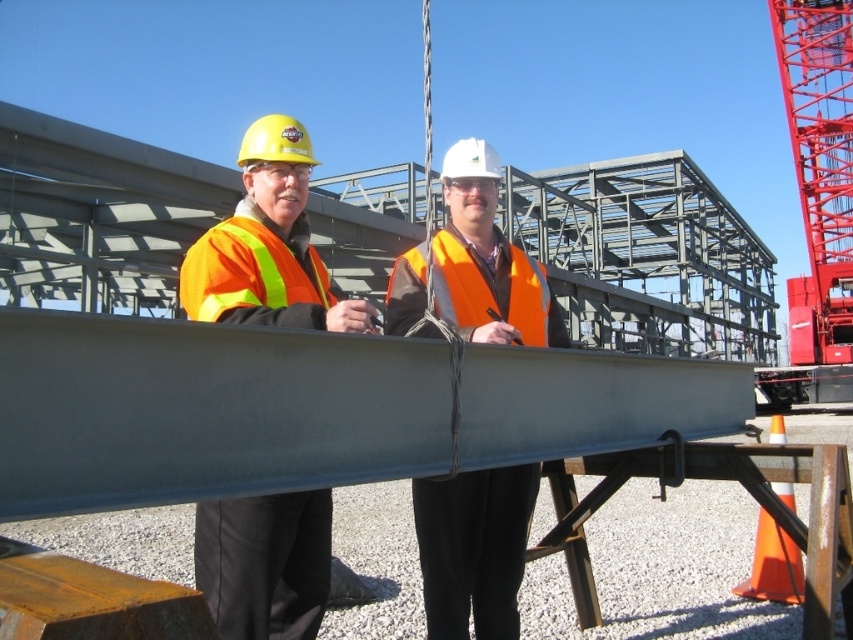
Does matte orange safety vest at left have a smaller size compared to orange reflective safety vest at left?

No, matte orange safety vest at left is not smaller than orange reflective safety vest at left.

Is point (265, 260) in front of point (262, 317)?

That is False.

Locate an element on the screen. The image size is (853, 640). matte orange safety vest at left is located at coordinates (268, 246).

Which is behind, point (259, 602) or point (398, 264)?

Positioned behind is point (398, 264).

Who is higher up, matte orange safety vest at left or orange reflective safety vest at center?

orange reflective safety vest at center is above.

Is point (252, 316) less distant than point (496, 296)?

Yes, point (252, 316) is in front of point (496, 296).

Locate an element on the screen. matte orange safety vest at left is located at coordinates (268, 246).

Is orange reflective vest at center positioned in front of orange reflective safety vest at center?

Yes.

What do you see at coordinates (473, 548) in the screenshot? The width and height of the screenshot is (853, 640). I see `orange reflective vest at center` at bounding box center [473, 548].

What do you see at coordinates (473, 548) in the screenshot?
I see `orange reflective vest at center` at bounding box center [473, 548].

The height and width of the screenshot is (640, 853). Identify the location of orange reflective vest at center. (473, 548).